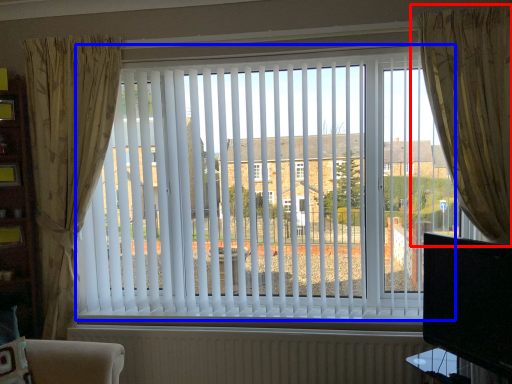
Question: Which object is closer to the camera taking this photo, curtain (highlighted by a red box) or window blind (highlighted by a blue box)?

Choices:
 (A) curtain
 (B) window blind

Answer: (A)